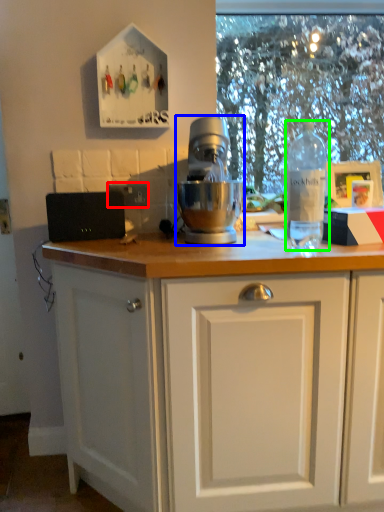
Question: Based on their relative distances, which object is nearer to electric outlet (highlighted by a red box)? Choose from mixer (highlighted by a blue box) and bottle (highlighted by a green box).

Choices:
 (A) mixer
 (B) bottle

Answer: (A)